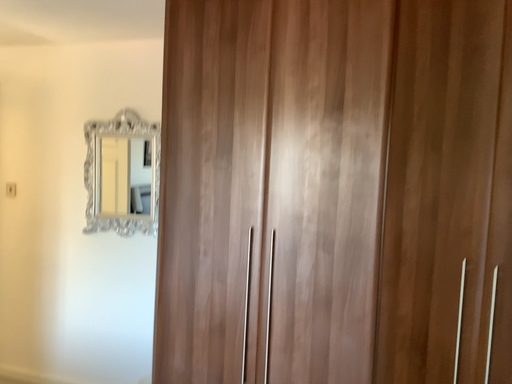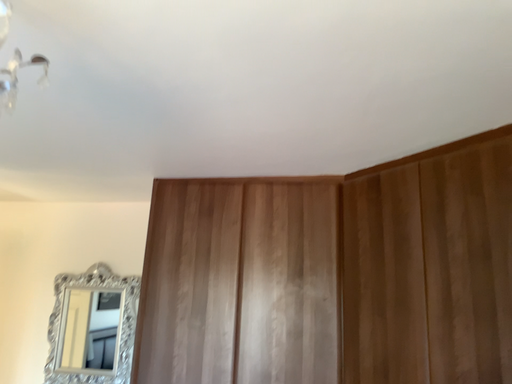
Question: Which way did the camera rotate in the video?

Choices:
 (A) rotated downward
 (B) rotated upward

Answer: (B)